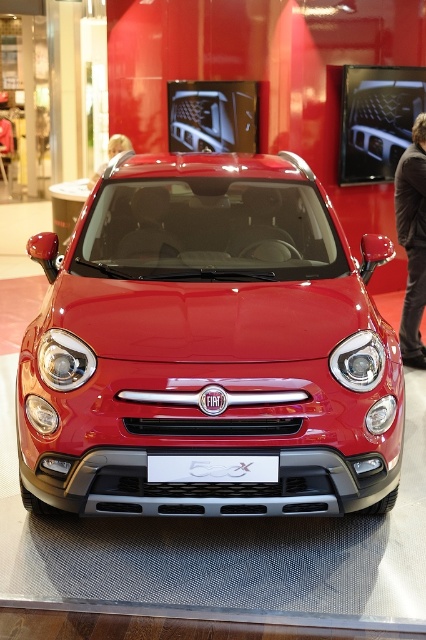
You are standing in a car showroom and want to take a closer look at the red Fiat 500X. There is a point marked at coordinates point (425, 140) on the car. If you walk towards the car, how far will you have to walk to reach that specific point on the car?

The distance of point (425, 140) from the viewer is 5.90 meters, so you will have to walk 5.90 meters to reach that specific point on the car.

You are standing in front of the red Fiat 500X at the car showroom. You notice two points on the car, one at coordinate point (x=92, y=294) and the other at point (x=109, y=154). Which of these points is closer to you?

Point (x=92, y=294) is closer to the viewer than point (x=109, y=154).